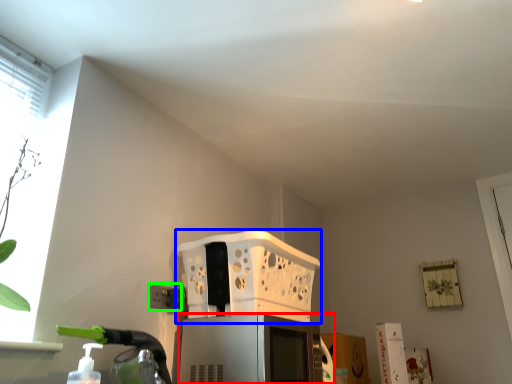
Question: Which object is the farthest from appliance (highlighted by a red box)? Choose among these: basket (highlighted by a blue box) or electric outlet (highlighted by a green box).

Choices:
 (A) basket
 (B) electric outlet

Answer: (A)